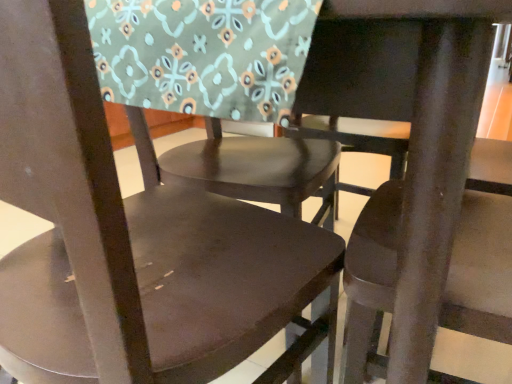
I want to click on matte brown chair at center, the 3th chair viewed from the right, so click(133, 241).

Describe the element at coordinates (217, 92) in the screenshot. I see `matte brown chair at center, placed as the second chair when sorted from right to left` at that location.

Measure the distance between point (454, 120) and camera.

The distance of point (454, 120) from camera is 13.50 inches.

What do you see at coordinates (415, 175) in the screenshot? I see `matte brown chair at center, which appears as the 1th chair when viewed from the right` at bounding box center [415, 175].

The width and height of the screenshot is (512, 384). Identify the location of matte brown chair at center, the 3th chair viewed from the right. (133, 241).

How distant is matte brown chair at center, which is counted as the first chair, starting from the left, from matte brown chair at center, which ranks as the third chair in left-to-right order?

matte brown chair at center, which is counted as the first chair, starting from the left, is 7.43 inches away from matte brown chair at center, which ranks as the third chair in left-to-right order.

From a real-world perspective, is matte brown chair at center, which is counted as the first chair, starting from the left, on matte brown chair at center, which appears as the 1th chair when viewed from the right?

Correct, in the physical world, matte brown chair at center, which is counted as the first chair, starting from the left, is higher than matte brown chair at center, which appears as the 1th chair when viewed from the right.

From the picture: What's the angular difference between matte brown chair at center, the 3th chair viewed from the right, and matte brown chair at center, which appears as the 1th chair when viewed from the right,'s facing directions?

106 degrees.

Is matte brown chair at center, the 3th chair viewed from the right, with matte brown chair at center, which appears as the 1th chair when viewed from the right?

They are not placed beside each other.

Is matte brown chair at center, placed as the second chair when sorted from right to left, positioned behind matte brown chair at center, which is counted as the first chair, starting from the left?

Yes, matte brown chair at center, placed as the second chair when sorted from right to left, is behind matte brown chair at center, which is counted as the first chair, starting from the left.

Considering the positions of objects matte brown chair at center, placed as the second chair when sorted from right to left, and matte brown chair at center, the 3th chair viewed from the right, in the image provided, who is more to the left, matte brown chair at center, placed as the second chair when sorted from right to left, or matte brown chair at center, the 3th chair viewed from the right,?

Positioned to the left is matte brown chair at center, the 3th chair viewed from the right.

How much distance is there between matte brown chair at center, which ranks as the third chair in left-to-right order, and matte brown chair at center, the 3th chair viewed from the right?

7.43 inches.

Is matte brown chair at center, which appears as the 1th chair when viewed from the right, oriented towards matte brown chair at center, which is counted as the first chair, starting from the left?

Yes, matte brown chair at center, which appears as the 1th chair when viewed from the right, is turned towards matte brown chair at center, which is counted as the first chair, starting from the left.

Which is behind, point (411, 283) or point (30, 68)?

Point (411, 283)

From the image's perspective, is matte brown chair at center, the 3th chair viewed from the right, above or below matte brown chair at center, arranged as the 2th chair when viewed from the left?

From the image's perspective, matte brown chair at center, the 3th chair viewed from the right, appears below matte brown chair at center, arranged as the 2th chair when viewed from the left.

Considering the positions of objects matte brown chair at center, which is counted as the first chair, starting from the left, and matte brown chair at center, placed as the second chair when sorted from right to left, in the image provided, who is behind, matte brown chair at center, which is counted as the first chair, starting from the left, or matte brown chair at center, placed as the second chair when sorted from right to left,?

Positioned behind is matte brown chair at center, placed as the second chair when sorted from right to left.

Does matte brown chair at center, arranged as the 2th chair when viewed from the left, contain matte brown chair at center, which ranks as the third chair in left-to-right order?

Definitely not — matte brown chair at center, which ranks as the third chair in left-to-right order, is not inside matte brown chair at center, arranged as the 2th chair when viewed from the left.

From a real-world perspective, count 2nd chairs downward from the matte brown chair at center, arranged as the 2th chair when viewed from the left, and point to it. Please provide its 2D coordinates.

[(415, 175)]

From the image's perspective, does matte brown chair at center, placed as the second chair when sorted from right to left, appear lower than matte brown chair at center, which appears as the 1th chair when viewed from the right?

No, from the image's perspective, matte brown chair at center, placed as the second chair when sorted from right to left, is not below matte brown chair at center, which appears as the 1th chair when viewed from the right.

Who is shorter, matte brown chair at center, placed as the second chair when sorted from right to left, or matte brown chair at center, which appears as the 1th chair when viewed from the right?

Standing shorter between the two is matte brown chair at center, placed as the second chair when sorted from right to left.

Is matte brown chair at center, which appears as the 1th chair when viewed from the right, next to matte brown chair at center, arranged as the 2th chair when viewed from the left?

No, matte brown chair at center, which appears as the 1th chair when viewed from the right, is not beside matte brown chair at center, arranged as the 2th chair when viewed from the left.

Is matte brown chair at center, which appears as the 1th chair when viewed from the right, shorter than matte brown chair at center, placed as the second chair when sorted from right to left?

No.

Which object is more forward, matte brown chair at center, which appears as the 1th chair when viewed from the right, or matte brown chair at center, arranged as the 2th chair when viewed from the left?

matte brown chair at center, arranged as the 2th chair when viewed from the left.

At what (x,y) coordinates should I click in order to perform the action: click on chair on the right of the matte brown chair at center, arranged as the 2th chair when viewed from the left. Please return your answer as a coordinate pair (x, y). Looking at the image, I should click on (415, 175).

In the image, there is a matte brown chair at center, which is counted as the first chair, starting from the left. At what (x,y) coordinates should I click in order to perform the action: click on chair below it (from the image's perspective). Please return your answer as a coordinate pair (x, y). Looking at the image, I should click on (415, 175).

I want to click on the 1st chair behind when counting from the matte brown chair at center, the 3th chair viewed from the right, so click(x=217, y=92).

Based on their spatial positions, is matte brown chair at center, which appears as the 1th chair when viewed from the right, or matte brown chair at center, which is counted as the first chair, starting from the left, further from matte brown chair at center, placed as the second chair when sorted from right to left?

matte brown chair at center, which appears as the 1th chair when viewed from the right, lies further to matte brown chair at center, placed as the second chair when sorted from right to left, than the other object.

From the image, which object appears to be farther from matte brown chair at center, the 3th chair viewed from the right, matte brown chair at center, arranged as the 2th chair when viewed from the left, or matte brown chair at center, which appears as the 1th chair when viewed from the right?

The object further to matte brown chair at center, the 3th chair viewed from the right, is matte brown chair at center, arranged as the 2th chair when viewed from the left.

Consider the image. When comparing their distances from matte brown chair at center, which is counted as the first chair, starting from the left, does matte brown chair at center, which ranks as the third chair in left-to-right order, or matte brown chair at center, placed as the second chair when sorted from right to left, seem further?

matte brown chair at center, placed as the second chair when sorted from right to left, is further to matte brown chair at center, which is counted as the first chair, starting from the left.

Considering their positions, is matte brown chair at center, the 3th chair viewed from the right, positioned further to matte brown chair at center, which appears as the 1th chair when viewed from the right, than matte brown chair at center, placed as the second chair when sorted from right to left?

matte brown chair at center, placed as the second chair when sorted from right to left.

Based on their spatial positions, is matte brown chair at center, the 3th chair viewed from the right, or matte brown chair at center, which ranks as the third chair in left-to-right order, further from matte brown chair at center, arranged as the 2th chair when viewed from the left?

Among the two, matte brown chair at center, which ranks as the third chair in left-to-right order, is located further to matte brown chair at center, arranged as the 2th chair when viewed from the left.

Looking at the image, which one is located further to matte brown chair at center, which ranks as the third chair in left-to-right order, matte brown chair at center, arranged as the 2th chair when viewed from the left, or matte brown chair at center, which is counted as the first chair, starting from the left?

matte brown chair at center, arranged as the 2th chair when viewed from the left, lies further to matte brown chair at center, which ranks as the third chair in left-to-right order, than the other object.

You are a GUI agent. You are given a task and a screenshot of the screen. Output one action in this format:
    pyautogui.click(x=<x>, y=<y>)
    Task: Click on the chair between matte brown chair at center, placed as the second chair when sorted from right to left, and matte brown chair at center, which appears as the 1th chair when viewed from the right, from top to bottom
    
    Given the screenshot: What is the action you would take?
    pyautogui.click(x=133, y=241)